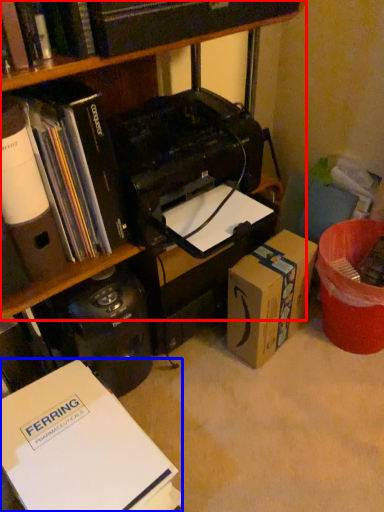
Question: Which point is further to the camera, bookcase (highlighted by a red box) or book (highlighted by a blue box)?

Choices:
 (A) bookcase
 (B) book

Answer: (A)